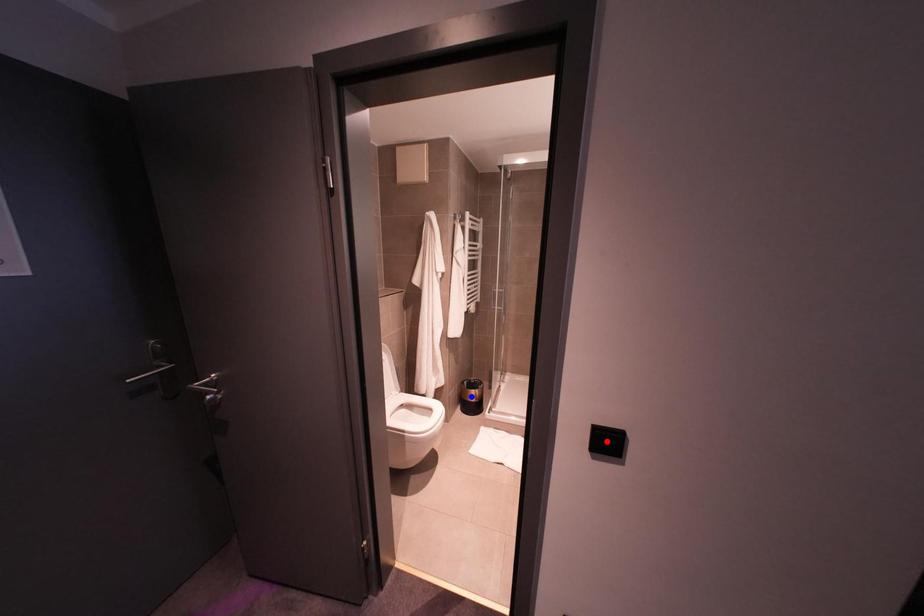
Question: Which of the two points in the image is closer to the camera?

Choices:
 (A) Blue point is closer.
 (B) Red point is closer.

Answer: (B)